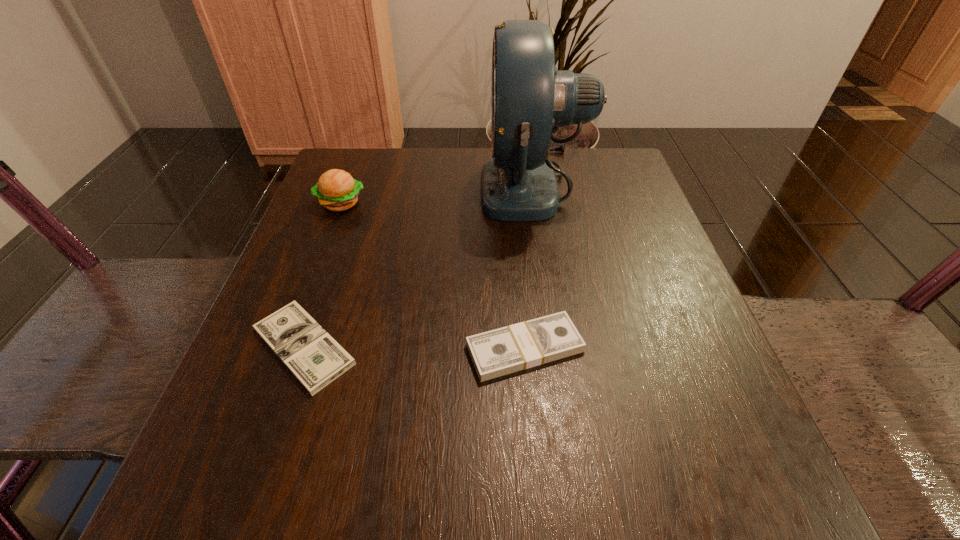
Where is `vacant space at the near edge`? vacant space at the near edge is located at coordinates (464, 501).

The height and width of the screenshot is (540, 960). In the image, there is a desktop. In order to click on vacant space at the left edge in this screenshot , I will do pos(319,215).

This screenshot has height=540, width=960. Find the location of `vacant space at the right edge of the desktop`. vacant space at the right edge of the desktop is located at coordinates (615, 233).

Identify the location of vacant space at the far left corner of the desktop. The height and width of the screenshot is (540, 960). (389, 158).

This screenshot has height=540, width=960. I want to click on vacant space at the near right corner, so click(x=715, y=504).

You are a GUI agent. You are given a task and a screenshot of the screen. Output one action in this format:
    pyautogui.click(x=<x>, y=<y>)
    Task: Click on the vacant area that lies between the left dollar and the tallest object
    The image size is (960, 540).
    Given the screenshot: What is the action you would take?
    pyautogui.click(x=419, y=267)

The height and width of the screenshot is (540, 960). Identify the location of free space that is in between the shortest object and the hamburger. (323, 275).

You are a GUI agent. You are given a task and a screenshot of the screen. Output one action in this format:
    pyautogui.click(x=<x>, y=<y>)
    Task: Click on the free space that is in between the second tallest object and the right dollar
    This screenshot has width=960, height=540.
    Given the screenshot: What is the action you would take?
    pyautogui.click(x=433, y=276)

Identify the location of free space between the third shortest object and the right dollar. This screenshot has height=540, width=960. (433, 276).

Locate an element on the screen. free space between the second tallest object and the right dollar is located at coordinates (433, 276).